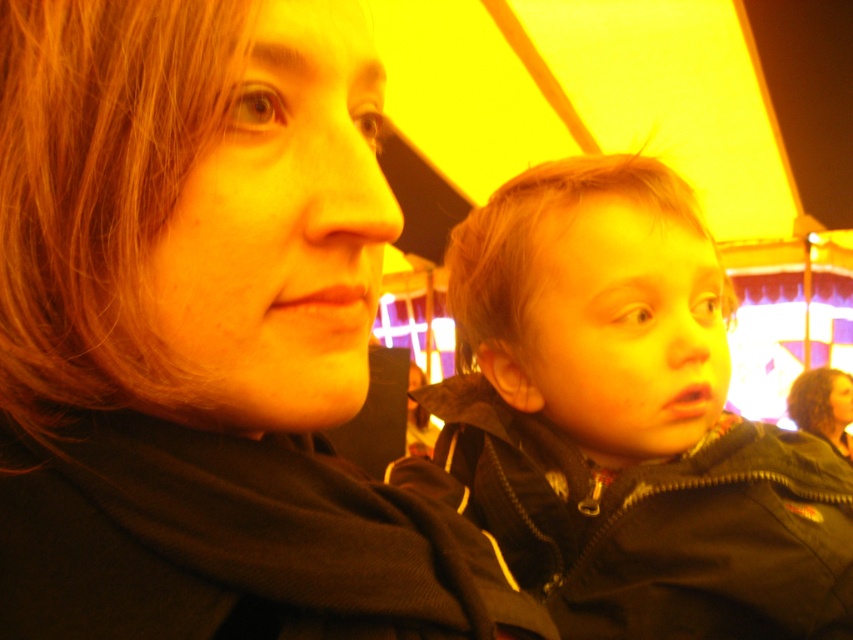
Question: Which point appears farthest from the camera in this image?

Choices:
 (A) (747, 452)
 (B) (184, 131)

Answer: (A)

Question: Can you confirm if matte black jacket at upper left is positioned to the left of matte black jacket at right?

Choices:
 (A) no
 (B) yes

Answer: (B)

Question: Is matte black jacket at upper left to the left of matte black jacket at right from the viewer's perspective?

Choices:
 (A) no
 (B) yes

Answer: (B)

Question: Which of the following is the farthest from the observer?

Choices:
 (A) matte black jacket at upper left
 (B) matte black jacket at right

Answer: (B)

Question: Does matte black jacket at upper left appear on the left side of matte black jacket at right?

Choices:
 (A) yes
 (B) no

Answer: (A)